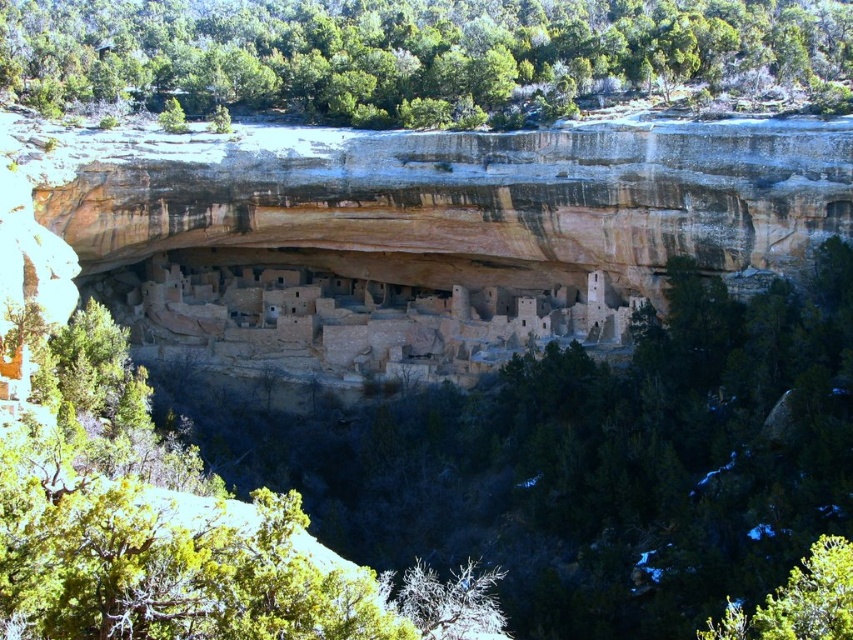
Can you confirm if green leafy tree at upper center is positioned below green leafy tree at lower right?

Actually, green leafy tree at upper center is above green leafy tree at lower right.

Can you confirm if green leafy tree at upper center is wider than green leafy tree at lower right?

Correct, the width of green leafy tree at upper center exceeds that of green leafy tree at lower right.

Which is in front, point (828, 29) or point (788, 609)?

Point (788, 609)

Locate an element on the screen. The image size is (853, 640). green leafy tree at upper center is located at coordinates (422, 58).